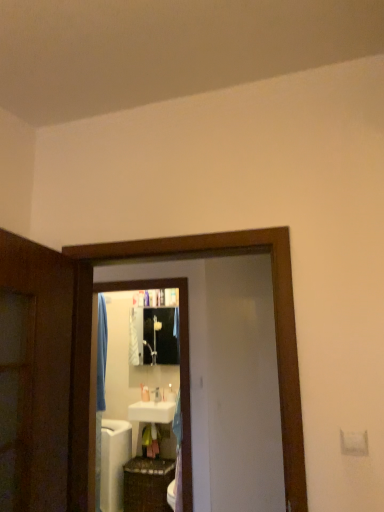
Question: Which is correct: white glossy bath at lower left is inside black glossy medicine cabinet at center, or outside of it?

Choices:
 (A) inside
 (B) outside

Answer: (B)

Question: Considering the positions of white glossy bath at lower left and black glossy medicine cabinet at center in the image, is white glossy bath at lower left wider or thinner than black glossy medicine cabinet at center?

Choices:
 (A) thin
 (B) wide

Answer: (B)

Question: Which object is the closest to the black glossy mirror at center?

Choices:
 (A) white glossy soap dispenser at center, marked as the 1th toiletry in a left-to-right arrangement
 (B) white glossy bath at lower left
 (C) white matte screen door at center, placed as the 2th screen door when sorted from front to back
 (D) woven brown basket at lower center
 (E) white glossy sink at center, which is counted as the second toiletry, starting from the left

Answer: (C)

Question: Estimate the real-world distances between objects in this image. Which object is closer to the black glossy mirror at center?

Choices:
 (A) woven brown basket at lower center
 (B) white glossy screen door at center, positioned as the 2th screen door in back-to-front order
 (C) white glossy bath at lower left
 (D) white matte screen door at center, which appears as the 1th screen door when viewed from the back
 (E) white glossy sink at center, which appears as the 1th toiletry when viewed from the front

Answer: (D)